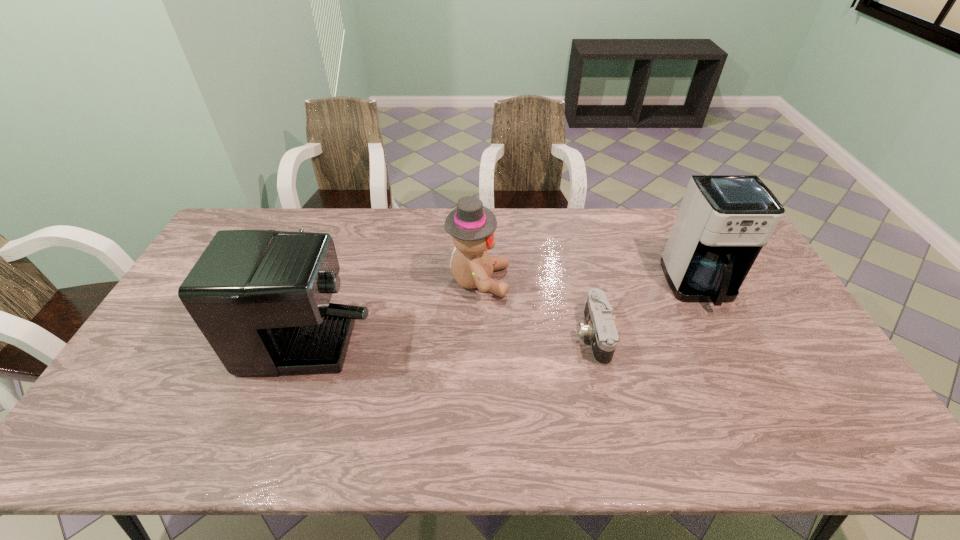
Identify the location of free point between the second object from left to right and the right coffee maker. (589, 284).

At what (x,y) coordinates should I click in order to perform the action: click on free space that is in between the shortest object and the leftmost object. Please return your answer as a coordinate pair (x, y). Looking at the image, I should click on (450, 316).

Where is `free spot between the rightmost object and the second object from right to left`? free spot between the rightmost object and the second object from right to left is located at coordinates (646, 311).

Locate an element on the screen. The height and width of the screenshot is (540, 960). empty space that is in between the left coffee maker and the camera is located at coordinates [x=450, y=316].

This screenshot has height=540, width=960. I want to click on vacant region between the third object from right to left and the left coffee maker, so 394,289.

Find the location of a particular element. This screenshot has width=960, height=540. empty space between the third object from right to left and the left coffee maker is located at coordinates (394, 289).

In order to click on vacant area that lies between the rag_doll and the right coffee maker in this screenshot , I will do `click(589, 284)`.

Identify which object is the second nearest to the leftmost object. Please provide its 2D coordinates. Your answer should be formatted as a tuple, i.e. [(x, y)], where the tuple contains the x and y coordinates of a point satisfying the conditions above.

[(601, 329)]

Locate an element on the screen. Image resolution: width=960 pixels, height=540 pixels. the third closest object to the rightmost object is located at coordinates (261, 298).

Find the location of a particular element. The image size is (960, 540). vacant position in the image that satisfies the following two spatial constraints: 1. on the front panel of the rightmost object; 2. on the front-facing side of the leftmost object is located at coordinates (706, 298).